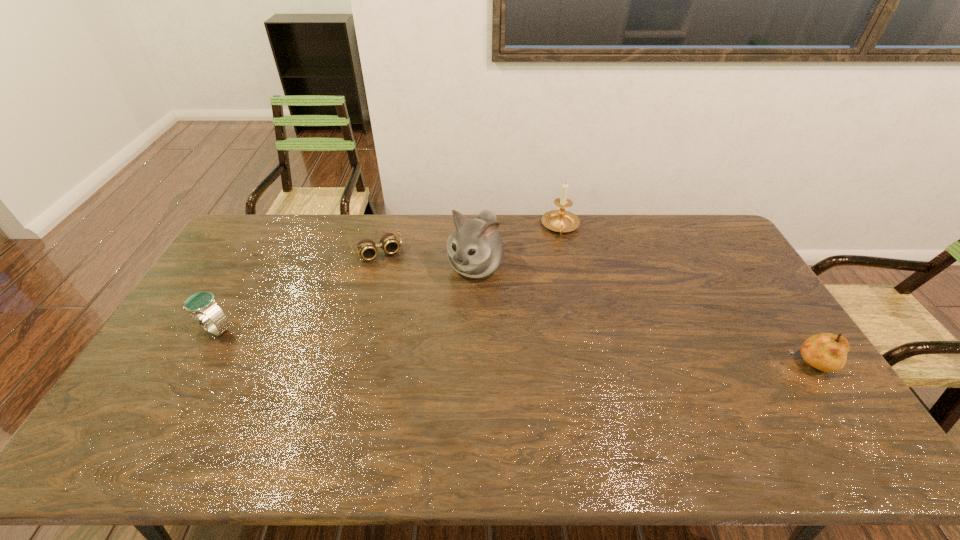
Where is `blank space at the near left corner of the desktop`? This screenshot has width=960, height=540. blank space at the near left corner of the desktop is located at coordinates (142, 393).

Locate an element on the screen. Image resolution: width=960 pixels, height=540 pixels. vacant area that lies between the hamster and the second tallest object is located at coordinates (518, 246).

Identify the location of vacant space that's between the fourth object from right to left and the watch. The image size is (960, 540). (297, 291).

I want to click on empty space between the watch and the tallest object, so click(x=346, y=298).

In order to click on empty location between the candle holder and the hamster in this screenshot , I will do `click(518, 246)`.

Identify the location of vacant area that lies between the second tallest object and the pear. (684, 295).

Identify the location of vacant area that lies between the fourth shortest object and the hamster. (518, 246).

You are a GUI agent. You are given a task and a screenshot of the screen. Output one action in this format:
    pyautogui.click(x=<x>, y=<y>)
    Task: Click on the free space between the watch and the pear
    The image size is (960, 540).
    Given the screenshot: What is the action you would take?
    pyautogui.click(x=512, y=347)

You are a GUI agent. You are given a task and a screenshot of the screen. Output one action in this format:
    pyautogui.click(x=<x>, y=<y>)
    Task: Click on the vacant region between the fourth farthest object and the tallest object
    This screenshot has height=540, width=960.
    Given the screenshot: What is the action you would take?
    pyautogui.click(x=346, y=298)

Identify the location of vacant space that is in between the third object from right to left and the watch. The height and width of the screenshot is (540, 960). (346, 298).